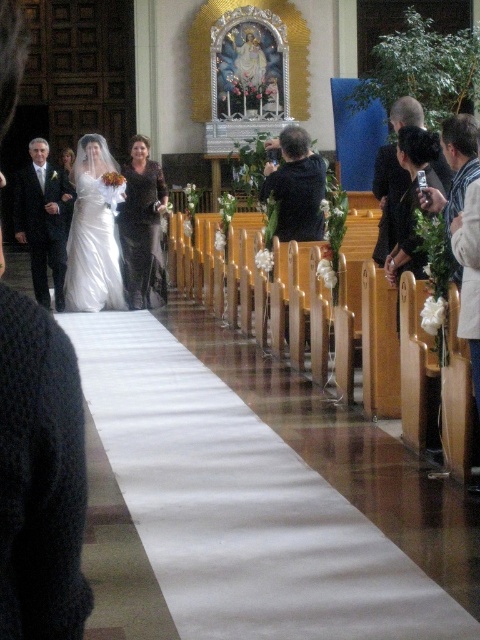
Looking at this image, you are a photographer standing at the back of the church, and you want to take a photo of both the matte black suit at left and the dark gray suit at left. The camera you are using has a maximum focus range of 20 meters. Can you capture both subjects in focus without moving closer?

The matte black suit at left and dark gray suit at left are 21.21 meters apart, which exceeds the camera maximum focus range of 20 meters. Therefore, you cannot capture both subjects in focus without moving closer.

You are a photographer at the back of the church during the wedding. You want to capture a clear photo of the black lace dress at center without the white fabric at center blocking it. What should you do?

The white fabric at center is taller than the black lace dress at center, so you should lower your camera angle to avoid the white fabric at center blocking the view of the black lace dress at center.

You are a photographer at the wedding and need to capture a shot of the two groomsmen wearing the matte black suit at left and dark gray suit at left. Which groomsmen is standing closer to the camera?

The matte black suit at left is positioned under the dark gray suit at left, meaning it is closer to the camera.